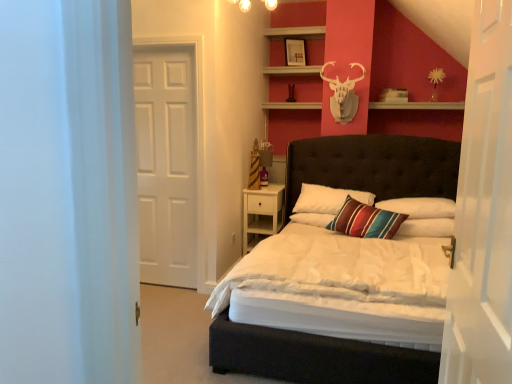
Question: Should I look upward or downward to see striped fabric pillow at center, which appears as the 1th pillow when viewed from the left?

Choices:
 (A) up
 (B) down

Answer: (B)

Question: Can you confirm if striped fabric pillow at center, the first pillow from the right, is taller than matte white picture frame at upper center?

Choices:
 (A) yes
 (B) no

Answer: (B)

Question: Is striped fabric pillow at center, the first pillow from the right, thinner than matte white picture frame at upper center?

Choices:
 (A) no
 (B) yes

Answer: (A)

Question: Is striped fabric pillow at center, which appears as the third pillow when viewed from the left, turned away from matte white picture frame at upper center?

Choices:
 (A) no
 (B) yes

Answer: (A)

Question: Is striped fabric pillow at center, the first pillow from the right, shorter than matte white picture frame at upper center?

Choices:
 (A) yes
 (B) no

Answer: (A)

Question: Can you confirm if striped fabric pillow at center, which appears as the third pillow when viewed from the left, is positioned to the right of matte white picture frame at upper center?

Choices:
 (A) yes
 (B) no

Answer: (A)

Question: Is striped fabric pillow at center, which appears as the third pillow when viewed from the left, aimed at matte white picture frame at upper center?

Choices:
 (A) no
 (B) yes

Answer: (A)

Question: Would you say matte white picture frame at upper center is a long distance from matte black bed at center?

Choices:
 (A) yes
 (B) no

Answer: (A)

Question: Does matte white picture frame at upper center have a larger size compared to matte black bed at center?

Choices:
 (A) yes
 (B) no

Answer: (B)

Question: Does matte white picture frame at upper center have a lesser width compared to matte black bed at center?

Choices:
 (A) yes
 (B) no

Answer: (A)

Question: Is matte white picture frame at upper center facing towards matte black bed at center?

Choices:
 (A) no
 (B) yes

Answer: (A)

Question: Can you confirm if matte white picture frame at upper center is wider than matte black bed at center?

Choices:
 (A) no
 (B) yes

Answer: (A)

Question: Does matte white picture frame at upper center lie in front of matte black bed at center?

Choices:
 (A) yes
 (B) no

Answer: (B)

Question: From a real-world perspective, is white glossy door at right, which ranks as the 2th door in back-to-front order, under white matte door at left, which ranks as the 2th door in front-to-back order?

Choices:
 (A) no
 (B) yes

Answer: (A)